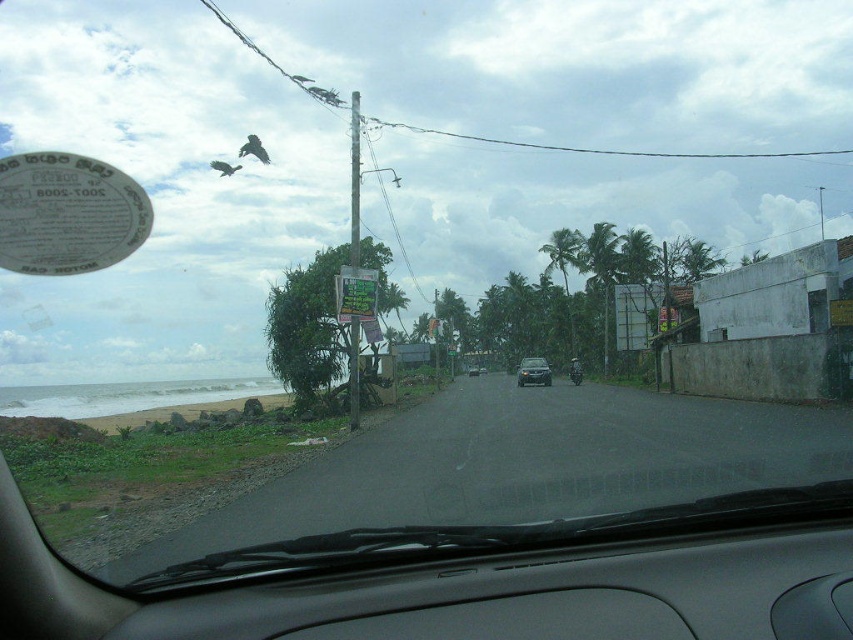
Question: Can you confirm if black matte dashboard at center is positioned to the left of satin silver sedan at center?

Choices:
 (A) no
 (B) yes

Answer: (B)

Question: Which of the following is the farthest from the observer?

Choices:
 (A) black matte dashboard at center
 (B) satin silver sedan at center

Answer: (B)

Question: Does black matte dashboard at center appear on the left side of satin silver sedan at center?

Choices:
 (A) no
 (B) yes

Answer: (B)

Question: Considering the relative positions of black matte dashboard at center and satin silver sedan at center in the image provided, where is black matte dashboard at center located with respect to satin silver sedan at center?

Choices:
 (A) left
 (B) right

Answer: (A)